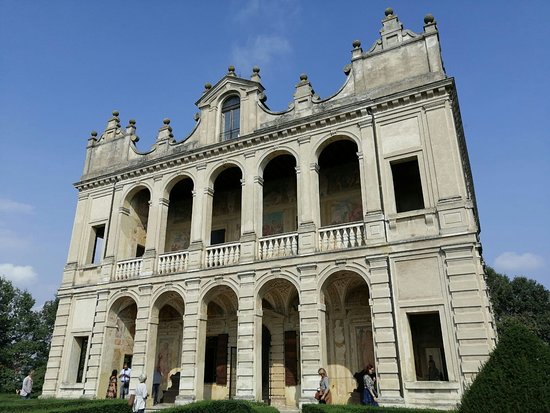
At what (x,y) coordinates should I click in order to perform the action: click on archway. Please return your answer as a coordinate pair (x, y). Looking at the image, I should click on (138, 218), (178, 218), (221, 215), (275, 212), (337, 201), (341, 328), (283, 322), (224, 334), (169, 341), (118, 337).